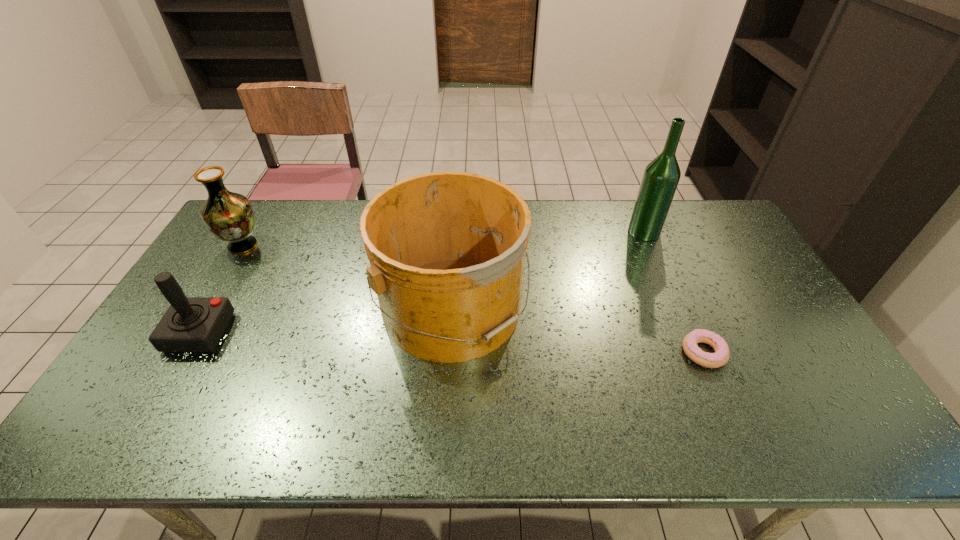
Locate an element on the screen. Image resolution: width=960 pixels, height=540 pixels. free space that satisfies the following two spatial constraints: 1. on the base of the joystick; 2. on the back side of the shortest object is located at coordinates (188, 353).

Locate an element on the screen. This screenshot has height=540, width=960. blank space that satisfies the following two spatial constraints: 1. on the back side of the tallest object; 2. on the right side of the vase is located at coordinates (252, 232).

Locate an element on the screen. vacant area in the image that satisfies the following two spatial constraints: 1. on the base of the shortest object; 2. on the left side of the fourth tallest object is located at coordinates (188, 353).

The image size is (960, 540). I want to click on free spot that satisfies the following two spatial constraints: 1. on the front side of the bucket; 2. on the right side of the third tallest object, so click(x=205, y=307).